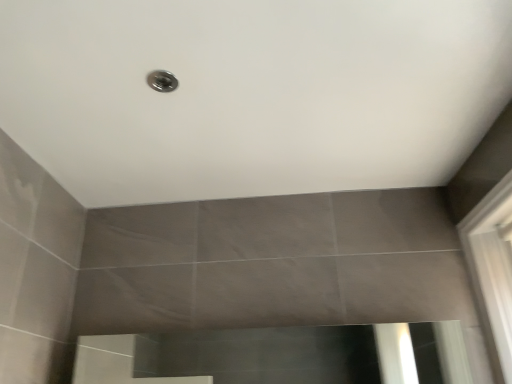
Describe the element at coordinates (162, 81) in the screenshot. I see `satin nickel showerhead at upper center` at that location.

Where is `satin nickel showerhead at upper center`? The image size is (512, 384). satin nickel showerhead at upper center is located at coordinates (162, 81).

What are the coordinates of `satin nickel showerhead at upper center` in the screenshot? It's located at (162, 81).